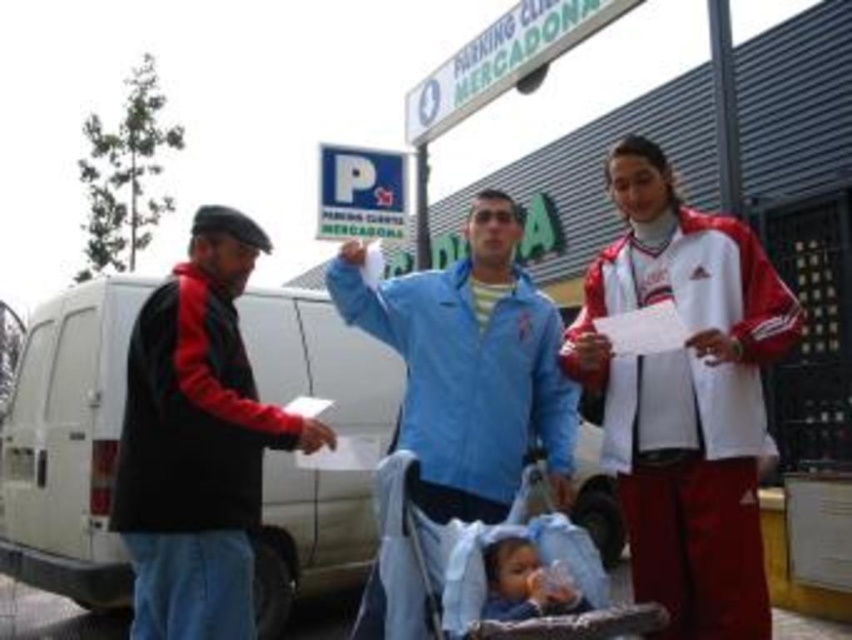
Based on the scene description, which of the two jackets, the black fleece jacket at left or the blue fabric jacket at center, is positioned lower in the frame?

The black fleece jacket at left is positioned lower in the frame than the blue fabric jacket at center.

Consider the image. Based on the scene description, which object is taller between the blue fabric baby carriage at center and the soft blue fabric at center?

The blue fabric baby carriage at center is taller than the soft blue fabric at center.

You are a photographer trying to capture a candid shot of the man in the light blue jacket and dark pants raising his arm. You notice the white matte van at left and the black fleece jacket at left in the background. Which object is taller and might block your view of the man?

The white matte van at left is taller than the black fleece jacket at left, so the van might block your view of the man.